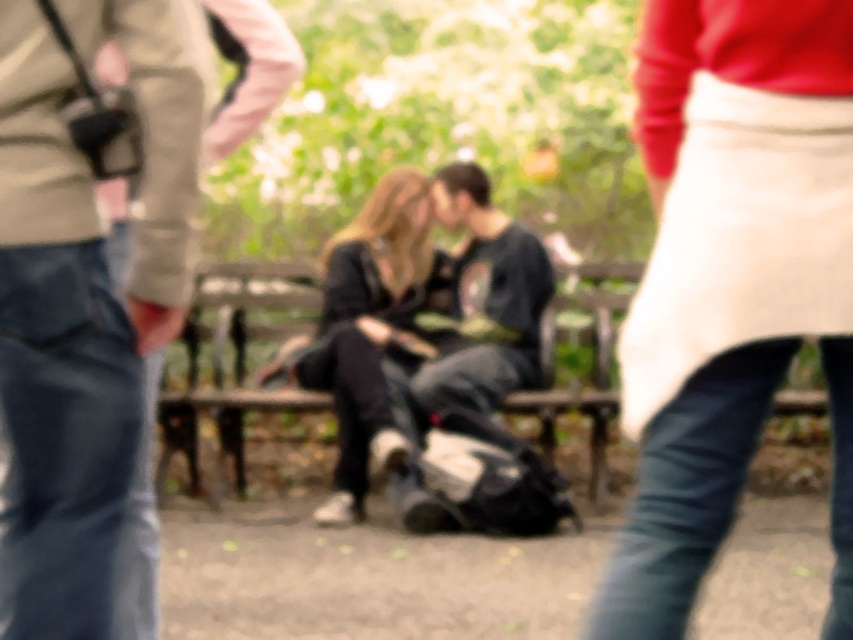
Measure the distance from black matte jacket at center to black matte shirt at center.

black matte jacket at center is 9.58 inches from black matte shirt at center.

Does point (422, 228) lie behind point (543, 292)?

Yes, it is.

Does point (337, 483) come farther from viewer compared to point (525, 372)?

No, it is not.

This screenshot has width=853, height=640. Find the location of `black matte jacket at center`. black matte jacket at center is located at coordinates (367, 332).

Is matte black backpack at center positioned at the back of black matte jacket at center?

No, matte black backpack at center is closer to the viewer.

Between matte black backpack at center and black matte jacket at center, which one appears on the right side from the viewer's perspective?

Positioned to the right is black matte jacket at center.

What do you see at coordinates (83, 310) in the screenshot? I see `matte black backpack at center` at bounding box center [83, 310].

I want to click on matte black backpack at center, so click(83, 310).

What do you see at coordinates (233, 365) in the screenshot? I see `wooden park bench at center` at bounding box center [233, 365].

In the scene shown: Does wooden park bench at center have a smaller size compared to black matte shirt at center?

Incorrect, wooden park bench at center is not smaller in size than black matte shirt at center.

Find the location of a particular element. The width and height of the screenshot is (853, 640). wooden park bench at center is located at coordinates (233, 365).

At what (x,y) coordinates should I click in order to perform the action: click on wooden park bench at center. Please return your answer as a coordinate pair (x, y). Looking at the image, I should click on (233, 365).